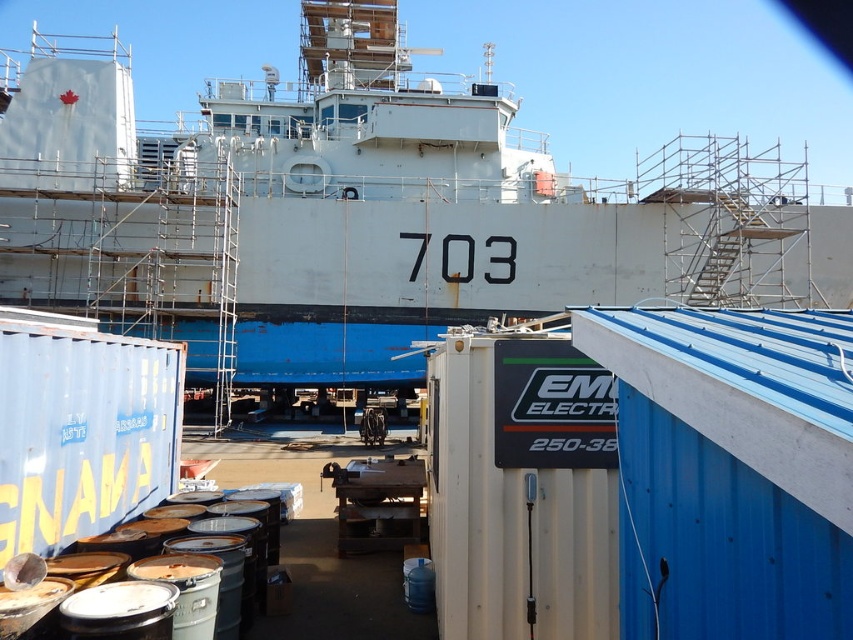
Which is behind, point (3, 497) or point (380, 541)?

Positioned behind is point (380, 541).

Identify the location of blue matte shipping container at lower left. point(80,428).

Looking at this image, between white matte ship at center and metallic dock at center, which one appears on the right side from the viewer's perspective?

metallic dock at center

You are a GUI agent. You are given a task and a screenshot of the screen. Output one action in this format:
    pyautogui.click(x=<x>, y=<y>)
    Task: Click on the white matte ship at center
    This screenshot has height=640, width=853.
    Given the screenshot: What is the action you would take?
    410,212

At what (x,y) coordinates should I click in order to perform the action: click on white matte ship at center. Please return your answer as a coordinate pair (x, y). The height and width of the screenshot is (640, 853). Looking at the image, I should click on (410, 212).

Between white matte ship at center and blue matte shipping container at lower left, which one has more height?

With more height is white matte ship at center.

Which of these two, white matte ship at center or blue matte shipping container at lower left, stands shorter?

blue matte shipping container at lower left

Locate an element on the screen. white matte ship at center is located at coordinates (410, 212).